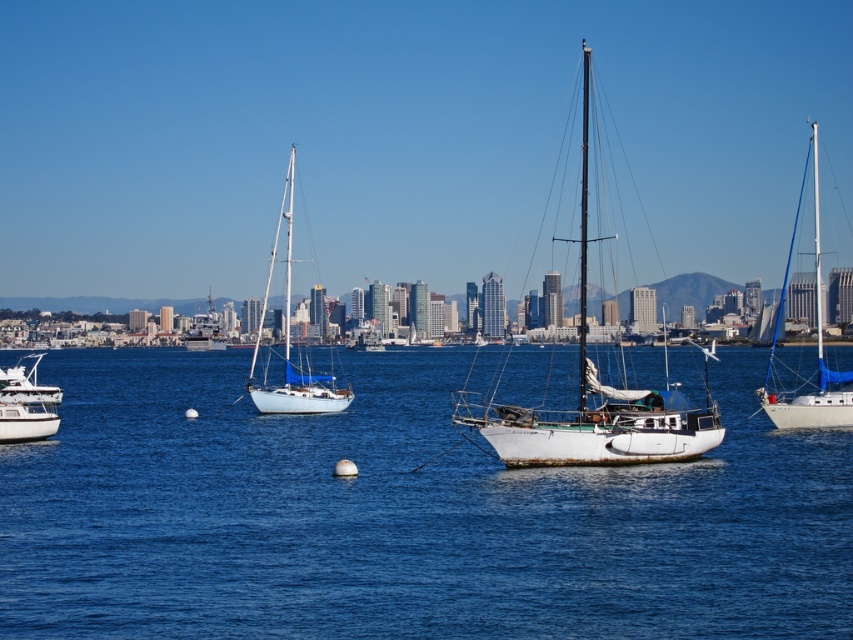
Measure the distance from blue water at center to white glossy yacht at lower left.

blue water at center and white glossy yacht at lower left are 89.98 meters apart from each other.

Can you confirm if blue water at center is thinner than white glossy yacht at lower left?

In fact, blue water at center might be wider than white glossy yacht at lower left.

Describe the element at coordinates (402, 515) in the screenshot. I see `blue water at center` at that location.

Locate an element on the screen. blue water at center is located at coordinates (402, 515).

Does point (785, 426) lie behind point (252, 362)?

No.

Can you confirm if white matte sailboat at right is positioned below white glossy sailboat at left?

Actually, white matte sailboat at right is above white glossy sailboat at left.

What do you see at coordinates (817, 356) in the screenshot?
I see `white matte sailboat at right` at bounding box center [817, 356].

At what (x,y) coordinates should I click in order to perform the action: click on white matte sailboat at right. Please return your answer as a coordinate pair (x, y). This screenshot has height=640, width=853. Looking at the image, I should click on (817, 356).

Who is taller, white matte sailboat at right or white glossy yacht at lower left?

white matte sailboat at right

What are the coordinates of `white matte sailboat at right` in the screenshot? It's located at (817, 356).

Find the location of a particular element. The width and height of the screenshot is (853, 640). white matte sailboat at right is located at coordinates (817, 356).